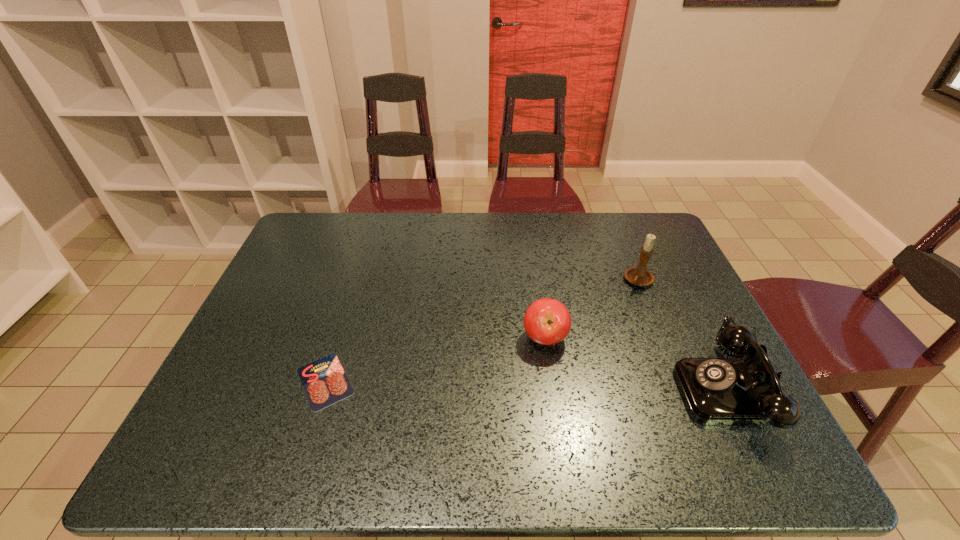
Where is `vacant area that lies between the telephone and the shortest object`? The height and width of the screenshot is (540, 960). vacant area that lies between the telephone and the shortest object is located at coordinates (526, 385).

This screenshot has height=540, width=960. I want to click on free space that is in between the candle holder and the shortest object, so click(482, 331).

The image size is (960, 540). In order to click on free space that is in between the candle holder and the telephone in this screenshot , I will do `click(684, 335)`.

At what (x,y) coordinates should I click in order to perform the action: click on vacant space that's between the leftmost object and the tallest object. Please return your answer as a coordinate pair (x, y). This screenshot has height=540, width=960. Looking at the image, I should click on (482, 331).

Locate an element on the screen. vacant area that lies between the shortest object and the telephone is located at coordinates (526, 385).

This screenshot has height=540, width=960. What are the coordinates of `free space between the apple and the tallest object` in the screenshot? It's located at (592, 309).

Locate an element on the screen. The height and width of the screenshot is (540, 960). free space between the tallest object and the leftmost object is located at coordinates (482, 331).

Identify which object is located as the nearest to the telephone. Please provide its 2D coordinates. Your answer should be formatted as a tuple, i.e. [(x, y)], where the tuple contains the x and y coordinates of a point satisfying the conditions above.

[(638, 275)]

The image size is (960, 540). What are the coordinates of `object that is the third nearest to the tallest object` in the screenshot? It's located at (324, 381).

At what (x,y) coordinates should I click in order to perform the action: click on free spot that satisfies the following two spatial constraints: 1. on the back side of the second object from left to right; 2. on the right side of the leftmost object. Please return your answer as a coordinate pair (x, y). This screenshot has height=540, width=960. Looking at the image, I should click on (339, 338).